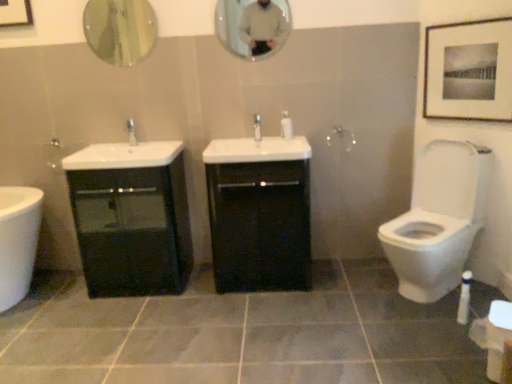
The width and height of the screenshot is (512, 384). I want to click on vacant space that's between black glossy cabinet at left, which appears as the second bathroom cabinet when viewed from the right, and white plastic toothbrush at lower right, so click(278, 304).